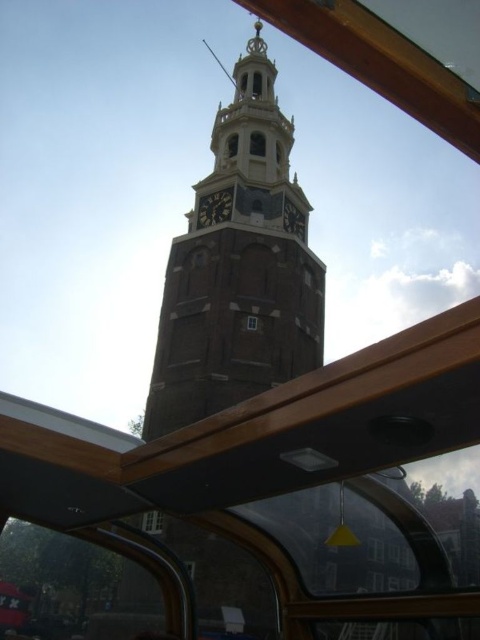
Is point (254, 150) farther from viewer compared to point (228, 150)?

No, it is in front of (228, 150).

Measure the distance from matte glass clock tower at upper center to matte brown clock tower at upper center.

3.35 meters

Does point (263, 156) come in front of point (228, 141)?

Yes.

Where is `matte glass clock tower at upper center`? The image size is (480, 640). matte glass clock tower at upper center is located at coordinates (256, 144).

From the picture: Is transparent glass window at center wider than clear glass window at center?

Yes.

Who is positioned more to the left, transparent glass window at center or clear glass window at center?

Positioned to the left is transparent glass window at center.

Describe the element at coordinates (153, 522) in the screenshot. I see `transparent glass window at center` at that location.

Locate an element on the screen. transparent glass window at center is located at coordinates (153, 522).

Can you confirm if brown brick tower at center is bigger than matte glass clock tower at upper center?

Indeed, brown brick tower at center has a larger size compared to matte glass clock tower at upper center.

From the picture: Which of these two, brown brick tower at center or matte glass clock tower at upper center, stands shorter?

With less height is matte glass clock tower at upper center.

Is point (250, 83) closer to camera compared to point (259, 147)?

No, (250, 83) is behind (259, 147).

Locate an element on the screen. This screenshot has width=480, height=640. brown brick tower at center is located at coordinates (238, 272).